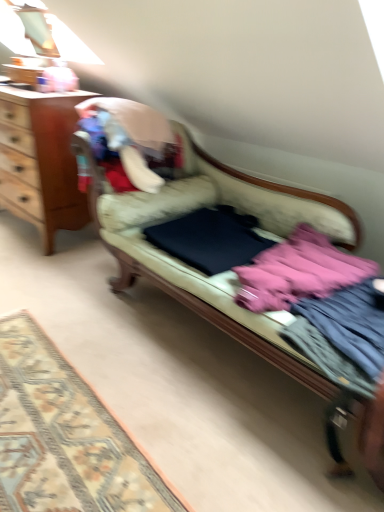
Where is `free space behind carpeted rug at lower left`? free space behind carpeted rug at lower left is located at coordinates (95, 308).